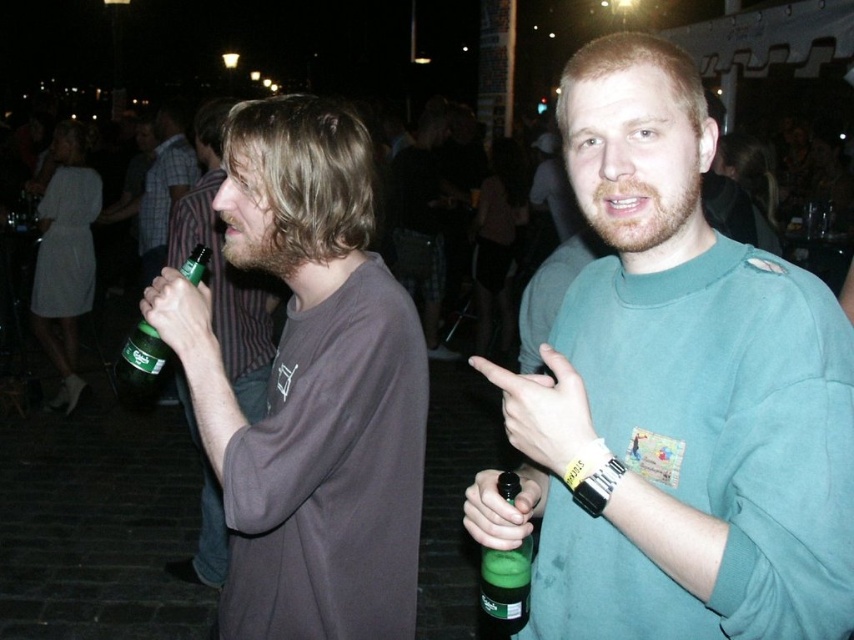
You are at a party and want to grab a drink. There are two green bottles in front of you. The green matte bottle at center and the green glass bottle at left. Which one is easier to reach without moving your current position?

The green matte bottle at center is closer to the viewer than the green glass bottle at left, so it is easier to reach without moving.

You are at a festival and need to decide whether to place a teal sweatshirt on a bench next to the matte brown shirt at left and the green matte bottle at center. Given their sizes, which item should you place the teal sweatshirt closer to?

The matte brown shirt at left is wider than the green matte bottle at center, so you should place the teal sweatshirt closer to the matte brown shirt at left to ensure proper spacing.